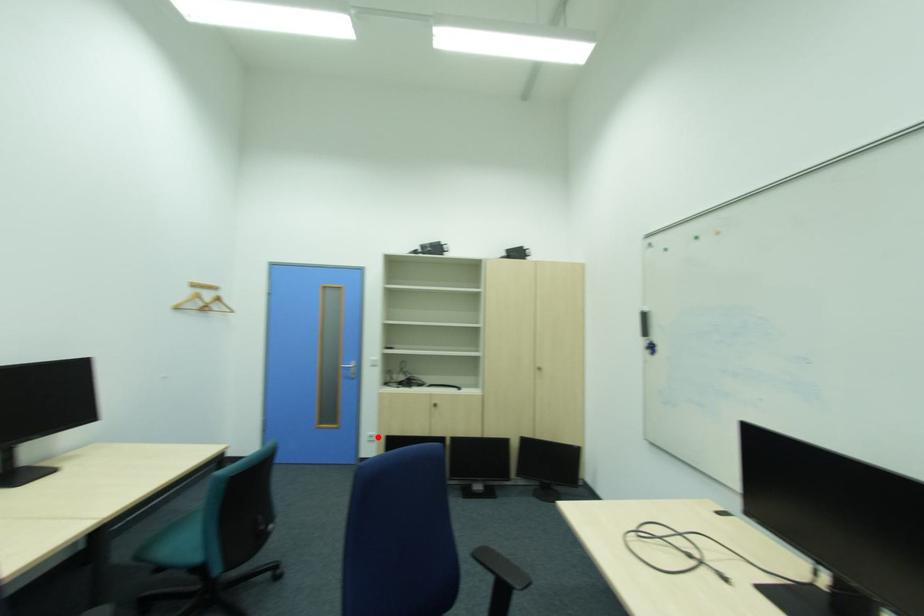
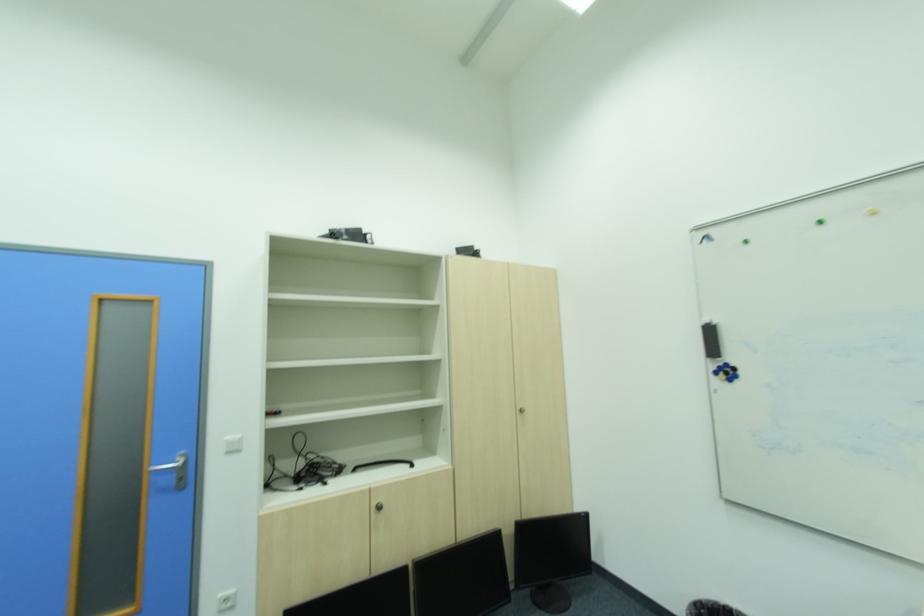
In the second image, find the point that corresponds to the highlighted location in the first image.

(234, 602)